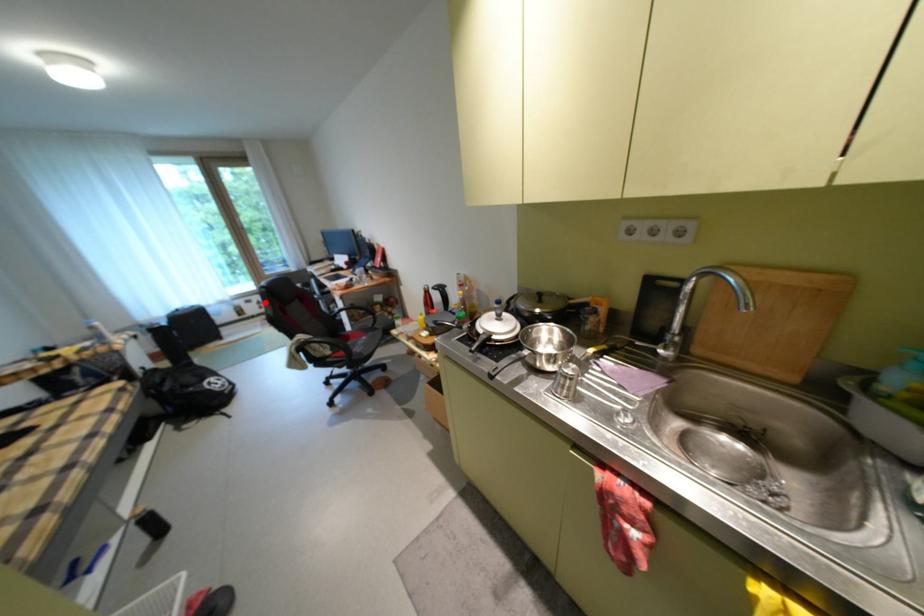
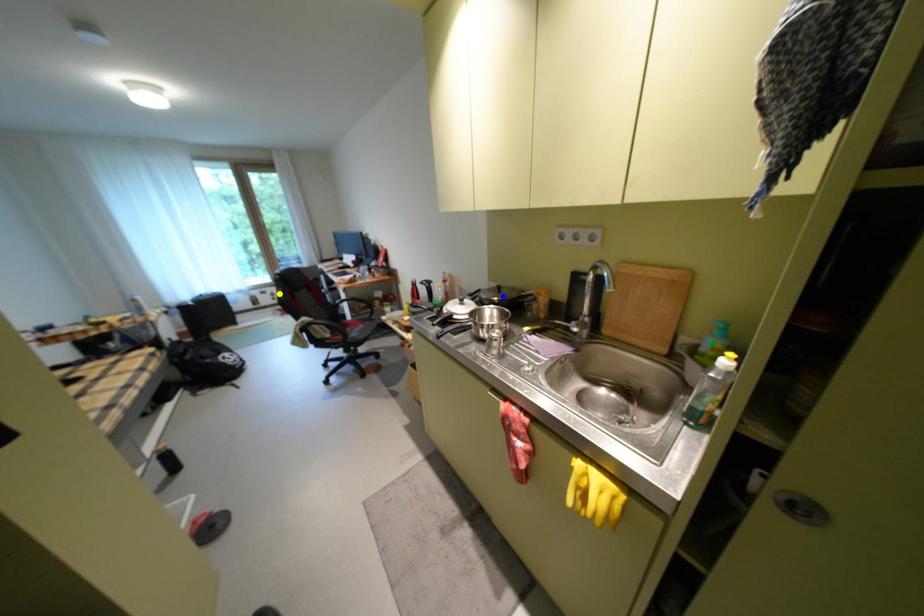
Question: I am providing you with two images of the same scene from different viewpoints. A red point is marked on the first image. You are given multiple points on the second image. In image 2, which mark is for the same physical point as the one in image 1?

Choices:
 (A) green point
 (B) yellow point
 (C) blue point

Answer: (B)